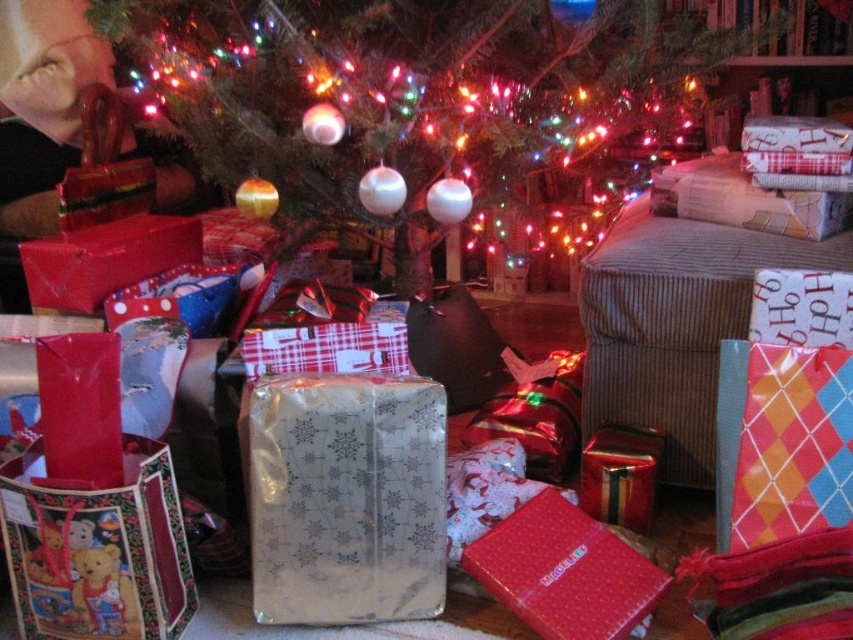
You are a guest at a Christmas party and see the teddy bear print fabric bag at lower left and the shiny metallic gift at center. Which gift is positioned lower in the image?

The teddy bear print fabric bag at lower left is positioned below the shiny metallic gift at center, so it is lower in the image.

You are standing in the festive Christmas scene and want to place a new gift near the shiny green tree at center. Based on the coordinates provided, where should you position the gift to ensure it is closest to the tree?

The shiny green tree at center is located at point (409, 86), so you should position the gift near those coordinates to be closest to the tree.